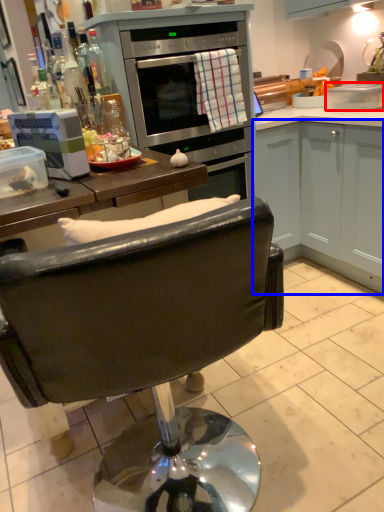
Question: Which object is closer to the camera taking this photo, pot/pan (highlighted by a red box) or cabinetry (highlighted by a blue box)?

Choices:
 (A) pot/pan
 (B) cabinetry

Answer: (B)